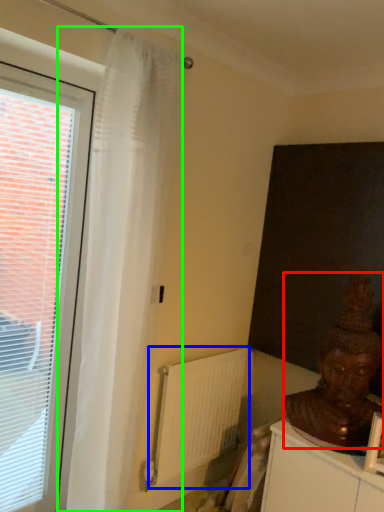
Question: Estimate the real-world distances between objects in this image. Which object is closer to person (highlighted by a red box), radiator (highlighted by a blue box) or curtain (highlighted by a green box)?

Choices:
 (A) radiator
 (B) curtain

Answer: (A)